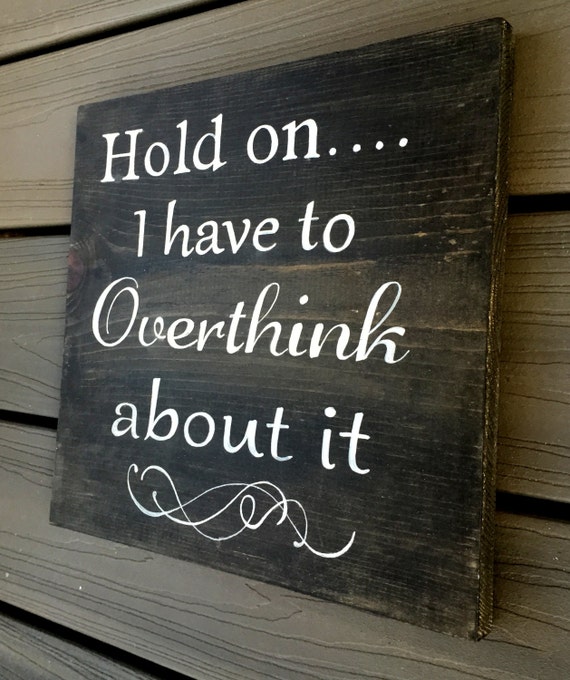
I want to click on wooden boards, so click(26, 651), click(35, 551), click(17, 313), click(28, 122), click(47, 5).